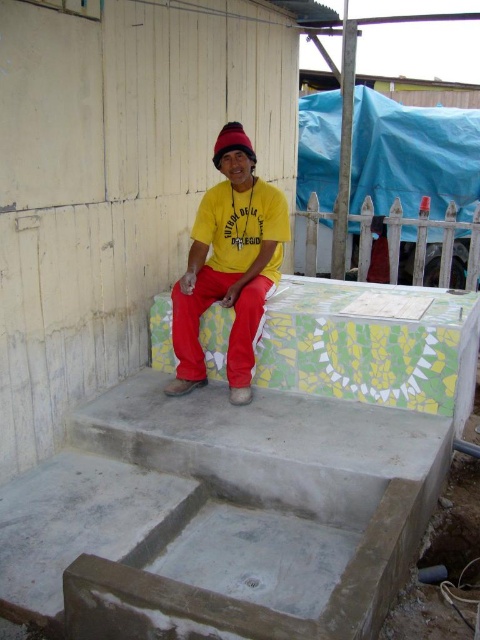
Question: Considering the relative positions of concrete stairs at center and yellow matte shirt at center in the image provided, where is concrete stairs at center located with respect to yellow matte shirt at center?

Choices:
 (A) below
 (B) above

Answer: (A)

Question: Does concrete stairs at center appear over yellow matte shirt at center?

Choices:
 (A) yes
 (B) no

Answer: (B)

Question: Is yellow matte shirt at center further to the viewer compared to knitted woolen beanie at center?

Choices:
 (A) no
 (B) yes

Answer: (A)

Question: Among these objects, which one is farthest from the camera?

Choices:
 (A) knitted woolen beanie at center
 (B) yellow matte shirt at center

Answer: (A)

Question: Which object is closer to the camera taking this photo?

Choices:
 (A) yellow matte shirt at center
 (B) knitted woolen beanie at center

Answer: (A)

Question: Which point appears farthest from the camera in this image?

Choices:
 (A) (269, 227)
 (B) (346, 516)

Answer: (A)